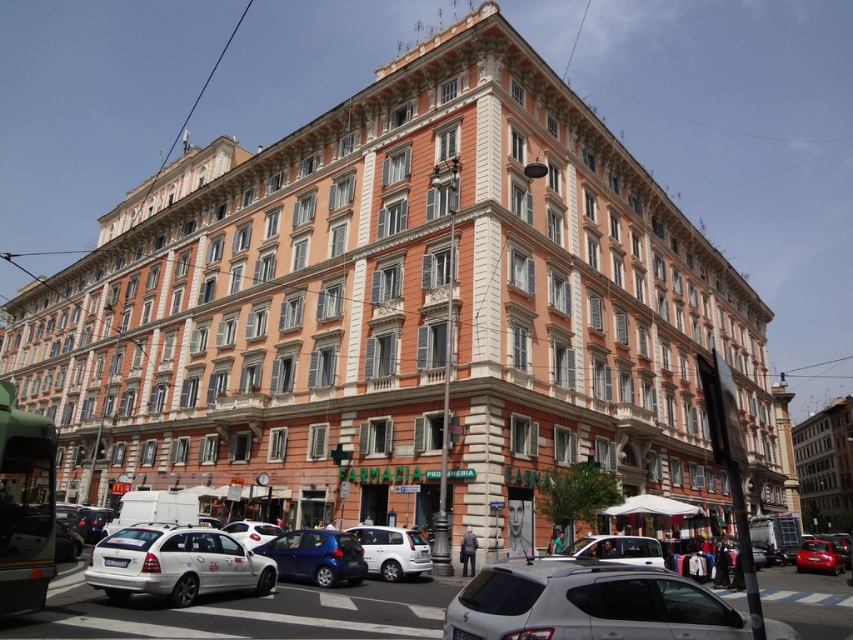
The width and height of the screenshot is (853, 640). Find the location of `white matte car at lower left`. white matte car at lower left is located at coordinates (175, 563).

Based on the photo, can you confirm if shiny red car at lower right is wider than white glossy car at center?

No, shiny red car at lower right is not wider than white glossy car at center.

This screenshot has width=853, height=640. I want to click on shiny red car at lower right, so click(x=817, y=556).

Does point (612, 544) come behind point (819, 541)?

No, (612, 544) is closer to viewer.

Is silver metallic car at lower center bigger than shiny red car at lower right?

Yes, silver metallic car at lower center is bigger than shiny red car at lower right.

Identify the location of silver metallic car at lower center. (614, 548).

This screenshot has height=640, width=853. In order to click on silver metallic car at lower center in this screenshot , I will do `click(614, 548)`.